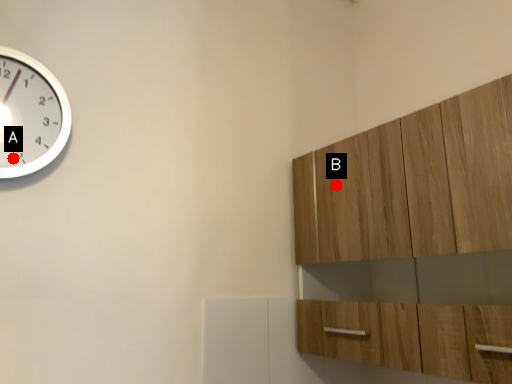
Question: Two points are circled on the image, labeled by A and B beside each circle. Which point is further to the camera?

Choices:
 (A) A is further
 (B) B is further

Answer: (B)